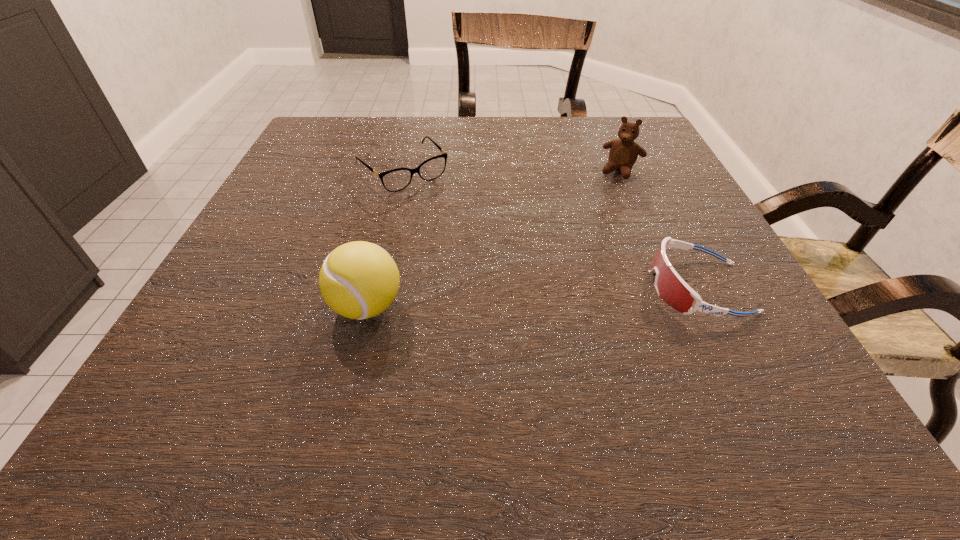
At what (x,y) coordinates should I click in order to perform the action: click on free spot on the desktop that is between the tennis ball and the goggles and is positioned on the front-facing side of the spectacles. Please return your answer as a coordinate pair (x, y). The image size is (960, 540). Looking at the image, I should click on (528, 298).

This screenshot has height=540, width=960. Identify the location of vacant space on the desktop that is between the tennis ball and the second shortest object and is positioned at the face of the teddy bear. (556, 296).